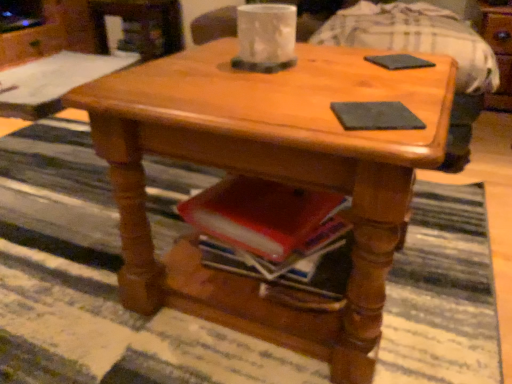
Measure the distance between black matte pad at upper right, placed as the second pad when sorted from left to right, and camera.

black matte pad at upper right, placed as the second pad when sorted from left to right, is 32.52 inches away from camera.

In order to face shiny wood coffee table at center, should I rotate leftwards or rightwards?

Turn right by 3.958 degrees to look at shiny wood coffee table at center.

Locate an element on the screen. matte black coaster at upper center is located at coordinates (424, 52).

The image size is (512, 384). Identify the location of black matte pad at upper right, the 2th pad from the front. (399, 61).

Considering the relative positions of black matte pad at upper right, placed as the 1th pad when sorted from top to bottom, and black matte pad at center, which appears as the 2th pad when viewed from the top, in the image provided, is black matte pad at upper right, placed as the 1th pad when sorted from top to bottom, to the left of black matte pad at center, which appears as the 2th pad when viewed from the top, from the viewer's perspective?

Incorrect, black matte pad at upper right, placed as the 1th pad when sorted from top to bottom, is not on the left side of black matte pad at center, which appears as the 2th pad when viewed from the top.

From a real-world perspective, which object stands above the other?

black matte pad at upper right, which appears as the 1th pad when viewed from the right, from a real-world perspective.

Would you consider black matte pad at upper right, placed as the second pad when sorted from left to right, to be distant from black matte pad at center, acting as the 1th pad starting from the bottom?

Actually, black matte pad at upper right, placed as the second pad when sorted from left to right, and black matte pad at center, acting as the 1th pad starting from the bottom, are a little close together.

Is black matte pad at upper right, arranged as the 2th pad when ordered from the bottom, not within black matte pad at center, acting as the 2th pad starting from the back?

Yes, black matte pad at upper right, arranged as the 2th pad when ordered from the bottom, is not within black matte pad at center, acting as the 2th pad starting from the back.

From the image's perspective, who appears lower, shiny wood coffee table at center or black matte pad at center, which is the first pad from front to back?

shiny wood coffee table at center is shown below in the image.

From a real-world perspective, between shiny wood coffee table at center and black matte pad at center, acting as the 1th pad starting from the bottom, who is vertically lower?

shiny wood coffee table at center, from a real-world perspective.

Which is correct: shiny wood coffee table at center is inside black matte pad at center, acting as the 2th pad starting from the back, or outside of it?

shiny wood coffee table at center lies outside black matte pad at center, acting as the 2th pad starting from the back.

Which object is closer to the camera, shiny wood coffee table at center or black matte pad at center, the 2th pad from the right?

shiny wood coffee table at center is closer to the camera.

From a real-world perspective, is black matte pad at center, marked as the 1th pad in a left-to-right arrangement, under matte black coaster at upper center?

No, from a real-world perspective, black matte pad at center, marked as the 1th pad in a left-to-right arrangement, is not beneath matte black coaster at upper center.

Considering the relative positions of black matte pad at center, the 2th pad from the right, and matte black coaster at upper center in the image provided, is black matte pad at center, the 2th pad from the right, to the right of matte black coaster at upper center from the viewer's perspective?

Incorrect, black matte pad at center, the 2th pad from the right, is not on the right side of matte black coaster at upper center.

Relative to matte black coaster at upper center, is black matte pad at center, marked as the 1th pad in a left-to-right arrangement, in front or behind?

In the image, black matte pad at center, marked as the 1th pad in a left-to-right arrangement, appears in front of matte black coaster at upper center.

From the image's perspective, is black matte pad at center, acting as the 1th pad starting from the bottom, positioned above or below matte black coaster at upper center?

Based on their image positions, black matte pad at center, acting as the 1th pad starting from the bottom, is located beneath matte black coaster at upper center.

Is matte black coaster at upper center wider or thinner than shiny wood coffee table at center?

In the image, matte black coaster at upper center appears to be wider than shiny wood coffee table at center.

Considering their positions, is matte black coaster at upper center located in front of or behind shiny wood coffee table at center?

matte black coaster at upper center is positioned farther from the viewer than shiny wood coffee table at center.

Is matte black coaster at upper center far away from shiny wood coffee table at center?

They are positioned close to each other.

Who is smaller, matte black coaster at upper center or shiny wood coffee table at center?

With smaller size is shiny wood coffee table at center.

Which object is closer to the camera, black matte pad at center, marked as the 1th pad in a left-to-right arrangement, or shiny wood coffee table at center?

shiny wood coffee table at center.

Consider the image. From a real-world perspective, is black matte pad at center, which appears as the 2th pad when viewed from the top, physically located above or below shiny wood coffee table at center?

black matte pad at center, which appears as the 2th pad when viewed from the top, is situated higher than shiny wood coffee table at center in the real world.

Locate an element on the screen. coffee table below the black matte pad at center, which appears as the 2th pad when viewed from the top (from the image's perspective) is located at coordinates (269, 177).

How many degrees apart are the facing directions of black matte pad at center, marked as the 1th pad in a left-to-right arrangement, and shiny wood coffee table at center?

black matte pad at center, marked as the 1th pad in a left-to-right arrangement, and shiny wood coffee table at center are facing 120 degrees away from each other.

Considering the points (370, 60) and (488, 51), which point is in front, point (370, 60) or point (488, 51)?

The point (370, 60) is closer to the camera.

Is black matte pad at upper right, acting as the 1th pad starting from the back, smaller than matte black coaster at upper center?

Correct, black matte pad at upper right, acting as the 1th pad starting from the back, occupies less space than matte black coaster at upper center.

Is black matte pad at upper right, placed as the second pad when sorted from left to right, surrounding matte black coaster at upper center?

No, matte black coaster at upper center is not a part of black matte pad at upper right, placed as the second pad when sorted from left to right.

Identify the location of swivel chair on the right of black matte pad at upper right, the 2th pad from the front. The image size is (512, 384). (424, 52).

Between shiny wood coffee table at center and matte black coaster at upper center, which one has smaller size?

shiny wood coffee table at center is smaller.

In the image, is shiny wood coffee table at center positioned in front of or behind matte black coaster at upper center?

shiny wood coffee table at center is in front of matte black coaster at upper center.

Could you tell me if shiny wood coffee table at center is facing matte black coaster at upper center?

No, shiny wood coffee table at center is not facing towards matte black coaster at upper center.

Where is `pad located behind the black matte pad at center, acting as the 2th pad starting from the back`? pad located behind the black matte pad at center, acting as the 2th pad starting from the back is located at coordinates (399, 61).

Find the location of a particular element. This screenshot has width=512, height=384. coffee table to the left of black matte pad at center, acting as the 2th pad starting from the back is located at coordinates (269, 177).

Considering their positions, is black matte pad at upper right, acting as the 1th pad starting from the back, positioned closer to shiny wood coffee table at center than matte black coaster at upper center?

black matte pad at upper right, acting as the 1th pad starting from the back, lies closer to shiny wood coffee table at center than the other object.

From the picture: Based on their spatial positions, is black matte pad at upper right, arranged as the 2th pad when ordered from the bottom, or shiny wood coffee table at center closer to black matte pad at center, acting as the 2th pad starting from the back?

shiny wood coffee table at center.

When comparing their distances from black matte pad at upper right, arranged as the 2th pad when ordered from the bottom, does black matte pad at center, acting as the 2th pad starting from the back, or shiny wood coffee table at center seem further?

shiny wood coffee table at center lies further to black matte pad at upper right, arranged as the 2th pad when ordered from the bottom, than the other object.

From the picture: Estimate the real-world distances between objects in this image. Which object is closer to black matte pad at upper right, which appears as the 1th pad when viewed from the right, shiny wood coffee table at center or black matte pad at center, marked as the 1th pad in a left-to-right arrangement?

Among the two, black matte pad at center, marked as the 1th pad in a left-to-right arrangement, is located nearer to black matte pad at upper right, which appears as the 1th pad when viewed from the right.

Considering their positions, is black matte pad at center, which appears as the 2th pad when viewed from the top, positioned further to black matte pad at upper right, which appears as the 1th pad when viewed from the right, than matte black coaster at upper center?

Among the two, matte black coaster at upper center is located further to black matte pad at upper right, which appears as the 1th pad when viewed from the right.

Which object lies further to the anchor point shiny wood coffee table at center, black matte pad at center, which is the first pad from front to back, or black matte pad at upper right, placed as the 1th pad when sorted from top to bottom?

Among the two, black matte pad at upper right, placed as the 1th pad when sorted from top to bottom, is located further to shiny wood coffee table at center.

Considering their positions, is shiny wood coffee table at center positioned further to matte black coaster at upper center than black matte pad at center, which is the first pad from front to back?

black matte pad at center, which is the first pad from front to back, is positioned further to the anchor matte black coaster at upper center.

Which object lies nearer to the anchor point black matte pad at center, acting as the 1th pad starting from the bottom, matte black coaster at upper center or black matte pad at upper right, placed as the 1th pad when sorted from top to bottom?

black matte pad at upper right, placed as the 1th pad when sorted from top to bottom.

Identify the location of pad located between shiny wood coffee table at center and black matte pad at upper right, arranged as the 2th pad when ordered from the bottom, in the depth direction. (375, 116).

This screenshot has width=512, height=384. What are the coordinates of `pad between black matte pad at center, marked as the 1th pad in a left-to-right arrangement, and matte black coaster at upper center from front to back` in the screenshot? It's located at (399, 61).